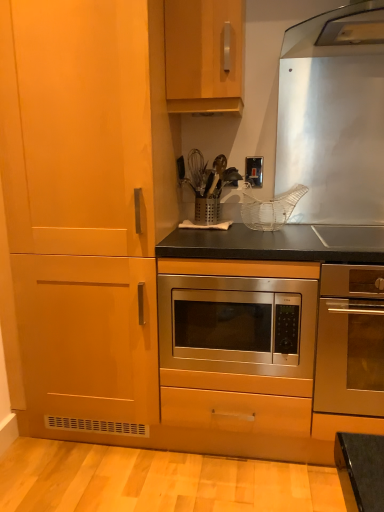
Image resolution: width=384 pixels, height=512 pixels. What do you see at coordinates (204, 55) in the screenshot? I see `wooden cabinet at upper center, the second cabinetry from the left` at bounding box center [204, 55].

Find the location of a particular element. This screenshot has height=512, width=384. stainless steel oven at center, which is counted as the 1th oven, starting from the right is located at coordinates (350, 341).

You are a GUI agent. You are given a task and a screenshot of the screen. Output one action in this format:
    pyautogui.click(x=<x>, y=<y>)
    Task: Click on the wooden cabinet at upper center, marked as the first cabinetry in a right-to-left arrangement
    The width and height of the screenshot is (384, 512).
    Given the screenshot: What is the action you would take?
    pyautogui.click(x=204, y=55)

Is wooden cabinet at upper center, the second cabinetry from the left, touching satin silver switch at upper center?

There is a gap between wooden cabinet at upper center, the second cabinetry from the left, and satin silver switch at upper center.

Consider the image. From the image's perspective, would you say wooden cabinet at upper center, marked as the first cabinetry in a right-to-left arrangement, is positioned over satin silver switch at upper center?

Yes, from the image's perspective, wooden cabinet at upper center, marked as the first cabinetry in a right-to-left arrangement, is over satin silver switch at upper center.

From the picture: Is wooden cabinet at upper center, the second cabinetry from the left, turned away from satin silver switch at upper center?

No, wooden cabinet at upper center, the second cabinetry from the left, is not facing away from satin silver switch at upper center.

Is the surface of wooden cabinet at upper center, the second cabinetry from the left, in direct contact with stainless steel oven at center, which is counted as the 1th oven, starting from the right?

wooden cabinet at upper center, the second cabinetry from the left, is not next to stainless steel oven at center, which is counted as the 1th oven, starting from the right, and they're not touching.

Between wooden cabinet at upper center, the second cabinetry from the left, and stainless steel oven at center, arranged as the second oven when viewed from the left, which one has larger size?

With larger size is stainless steel oven at center, arranged as the second oven when viewed from the left.

What's the angular difference between wooden cabinet at upper center, the second cabinetry from the left, and stainless steel oven at center, which is counted as the 1th oven, starting from the right,'s facing directions?

They differ by 1.17 degrees in their facing directions.

How much distance is there between wooden cabinet at upper center, the second cabinetry from the left, and stainless steel oven at center, arranged as the second oven when viewed from the left?

They are 39.06 inches apart.

Between satin silver switch at upper center and matte wood cabinet at left, the first cabinetry positioned from the left, which one appears on the right side from the viewer's perspective?

satin silver switch at upper center is more to the right.

From the image's perspective, which one is positioned higher, satin silver switch at upper center or matte wood cabinet at left, the first cabinetry positioned from the left?

satin silver switch at upper center appears higher in the image.

Which is behind, point (260, 162) or point (100, 173)?

The point (260, 162) is behind.

Does satin silver switch at upper center have a smaller size compared to matte wood cabinet at left, the first cabinetry positioned from the left?

Correct, satin silver switch at upper center occupies less space than matte wood cabinet at left, the first cabinetry positioned from the left.

In the image, is wooden cabinet at upper center, marked as the first cabinetry in a right-to-left arrangement, on the left side or the right side of stainless steel microwave at center, which is the 2th oven in right-to-left order?

wooden cabinet at upper center, marked as the first cabinetry in a right-to-left arrangement, is positioned on stainless steel microwave at center, which is the 2th oven in right-to-left order,'s left side.

Is wooden cabinet at upper center, marked as the first cabinetry in a right-to-left arrangement, surrounding stainless steel microwave at center, marked as the first oven in a left-to-right arrangement?

No, stainless steel microwave at center, marked as the first oven in a left-to-right arrangement, is not surrounded by wooden cabinet at upper center, marked as the first cabinetry in a right-to-left arrangement.

Does wooden cabinet at upper center, the second cabinetry from the left, have a greater height compared to stainless steel microwave at center, which is the 2th oven in right-to-left order?

Yes.

Considering the sizes of objects wooden cabinet at upper center, marked as the first cabinetry in a right-to-left arrangement, and stainless steel microwave at center, marked as the first oven in a left-to-right arrangement, in the image provided, who is bigger, wooden cabinet at upper center, marked as the first cabinetry in a right-to-left arrangement, or stainless steel microwave at center, marked as the first oven in a left-to-right arrangement,?

stainless steel microwave at center, marked as the first oven in a left-to-right arrangement, is bigger.

Is stainless steel oven at center, arranged as the second oven when viewed from the left, completely or partially inside matte wood cabinet at left, marked as the 2th cabinetry in a right-to-left arrangement?

No, stainless steel oven at center, arranged as the second oven when viewed from the left, is not surrounded by matte wood cabinet at left, marked as the 2th cabinetry in a right-to-left arrangement.

From the image's perspective, which one is positioned lower, matte wood cabinet at left, the first cabinetry positioned from the left, or stainless steel oven at center, arranged as the second oven when viewed from the left?

stainless steel oven at center, arranged as the second oven when viewed from the left, is shown below in the image.

Who is more distant, matte wood cabinet at left, marked as the 2th cabinetry in a right-to-left arrangement, or stainless steel oven at center, which is counted as the 1th oven, starting from the right?

stainless steel oven at center, which is counted as the 1th oven, starting from the right, is behind.

Considering the sizes of matte wood cabinet at left, marked as the 2th cabinetry in a right-to-left arrangement, and stainless steel oven at center, arranged as the second oven when viewed from the left, in the image, is matte wood cabinet at left, marked as the 2th cabinetry in a right-to-left arrangement, taller or shorter than stainless steel oven at center, arranged as the second oven when viewed from the left,?

matte wood cabinet at left, marked as the 2th cabinetry in a right-to-left arrangement, is taller than stainless steel oven at center, arranged as the second oven when viewed from the left.

Identify the location of oven in front of the stainless steel microwave at center, which is the 2th oven in right-to-left order. The image size is (384, 512). (350, 341).

Between stainless steel oven at center, arranged as the second oven when viewed from the left, and stainless steel microwave at center, marked as the first oven in a left-to-right arrangement, which one has larger width?

Wider between the two is stainless steel oven at center, arranged as the second oven when viewed from the left.

Considering the relative positions of stainless steel oven at center, which is counted as the 1th oven, starting from the right, and stainless steel microwave at center, which is the 2th oven in right-to-left order, in the image provided, is stainless steel oven at center, which is counted as the 1th oven, starting from the right, to the right of stainless steel microwave at center, which is the 2th oven in right-to-left order, from the viewer's perspective?

Indeed, stainless steel oven at center, which is counted as the 1th oven, starting from the right, is positioned on the right side of stainless steel microwave at center, which is the 2th oven in right-to-left order.

Between stainless steel oven at center, arranged as the second oven when viewed from the left, and stainless steel microwave at center, which is the 2th oven in right-to-left order, which one is positioned behind?

stainless steel microwave at center, which is the 2th oven in right-to-left order, is behind.

In terms of height, does stainless steel microwave at center, marked as the first oven in a left-to-right arrangement, look taller or shorter compared to stainless steel oven at center, which is counted as the 1th oven, starting from the right?

stainless steel microwave at center, marked as the first oven in a left-to-right arrangement, is shorter than stainless steel oven at center, which is counted as the 1th oven, starting from the right.

From a real-world perspective, is stainless steel microwave at center, which is the 2th oven in right-to-left order, beneath stainless steel oven at center, arranged as the second oven when viewed from the left?

No, from a real-world perspective, stainless steel microwave at center, which is the 2th oven in right-to-left order, is not under stainless steel oven at center, arranged as the second oven when viewed from the left.

Between stainless steel microwave at center, marked as the first oven in a left-to-right arrangement, and stainless steel oven at center, arranged as the second oven when viewed from the left, which one has larger size?

With larger size is stainless steel oven at center, arranged as the second oven when viewed from the left.

Do you think stainless steel microwave at center, marked as the first oven in a left-to-right arrangement, is within stainless steel oven at center, which is counted as the 1th oven, starting from the right, or outside of it?

stainless steel microwave at center, marked as the first oven in a left-to-right arrangement, is not enclosed by stainless steel oven at center, which is counted as the 1th oven, starting from the right.

Identify the location of cabinetry that appears above the satin silver switch at upper center (from the image's perspective). The image size is (384, 512). (204, 55).

This screenshot has width=384, height=512. I want to click on the 2nd oven located beneath the wooden cabinet at upper center, marked as the first cabinetry in a right-to-left arrangement (from a real-world perspective), so click(350, 341).

Consider the image. Which object lies nearer to the anchor point wooden cabinet at upper center, marked as the first cabinetry in a right-to-left arrangement, satin silver switch at upper center or stainless steel oven at center, which is counted as the 1th oven, starting from the right?

satin silver switch at upper center is positioned closer to the anchor wooden cabinet at upper center, marked as the first cabinetry in a right-to-left arrangement.

When comparing their distances from matte wood cabinet at left, marked as the 2th cabinetry in a right-to-left arrangement, does satin silver switch at upper center or stainless steel oven at center, which is counted as the 1th oven, starting from the right, seem further?

satin silver switch at upper center.

When comparing their distances from stainless steel microwave at center, marked as the first oven in a left-to-right arrangement, does stainless steel oven at center, which is counted as the 1th oven, starting from the right, or satin silver switch at upper center seem closer?

Based on the image, stainless steel oven at center, which is counted as the 1th oven, starting from the right, appears to be nearer to stainless steel microwave at center, marked as the first oven in a left-to-right arrangement.

Which object lies nearer to the anchor point stainless steel microwave at center, which is the 2th oven in right-to-left order, wooden cabinet at upper center, the second cabinetry from the left, or stainless steel oven at center, arranged as the second oven when viewed from the left?

stainless steel oven at center, arranged as the second oven when viewed from the left, is closer to stainless steel microwave at center, which is the 2th oven in right-to-left order.

Looking at this image, based on their spatial positions, is satin silver switch at upper center or wooden cabinet at upper center, the second cabinetry from the left, further from matte wood cabinet at left, the first cabinetry positioned from the left?

satin silver switch at upper center lies further to matte wood cabinet at left, the first cabinetry positioned from the left, than the other object.

In the scene shown: Based on their spatial positions, is stainless steel oven at center, which is counted as the 1th oven, starting from the right, or stainless steel microwave at center, which is the 2th oven in right-to-left order, closer to wooden cabinet at upper center, marked as the first cabinetry in a right-to-left arrangement?

stainless steel microwave at center, which is the 2th oven in right-to-left order, is closer to wooden cabinet at upper center, marked as the first cabinetry in a right-to-left arrangement.

Considering their positions, is stainless steel oven at center, which is counted as the 1th oven, starting from the right, positioned further to wooden cabinet at upper center, marked as the first cabinetry in a right-to-left arrangement, than satin silver switch at upper center?

stainless steel oven at center, which is counted as the 1th oven, starting from the right, is positioned further to the anchor wooden cabinet at upper center, marked as the first cabinetry in a right-to-left arrangement.

Considering their positions, is stainless steel oven at center, which is counted as the 1th oven, starting from the right, positioned further to stainless steel microwave at center, marked as the first oven in a left-to-right arrangement, than wooden cabinet at upper center, marked as the first cabinetry in a right-to-left arrangement?

The object further to stainless steel microwave at center, marked as the first oven in a left-to-right arrangement, is wooden cabinet at upper center, marked as the first cabinetry in a right-to-left arrangement.

Locate an element on the screen. This screenshot has width=384, height=512. oven that lies between satin silver switch at upper center and stainless steel oven at center, arranged as the second oven when viewed from the left, from top to bottom is located at coordinates (237, 324).

The image size is (384, 512). Identify the location of oven between wooden cabinet at upper center, the second cabinetry from the left, and stainless steel oven at center, which is counted as the 1th oven, starting from the right, in the vertical direction. (237, 324).

Image resolution: width=384 pixels, height=512 pixels. Find the location of `electric outlet between wooden cabinet at upper center, the second cabinetry from the left, and stainless steel microwave at center, marked as the first oven in a left-to-right arrangement, in the up-down direction`. electric outlet between wooden cabinet at upper center, the second cabinetry from the left, and stainless steel microwave at center, marked as the first oven in a left-to-right arrangement, in the up-down direction is located at coordinates (254, 170).

Locate an element on the screen. The height and width of the screenshot is (512, 384). cabinetry positioned between matte wood cabinet at left, the first cabinetry positioned from the left, and satin silver switch at upper center from near to far is located at coordinates (204, 55).